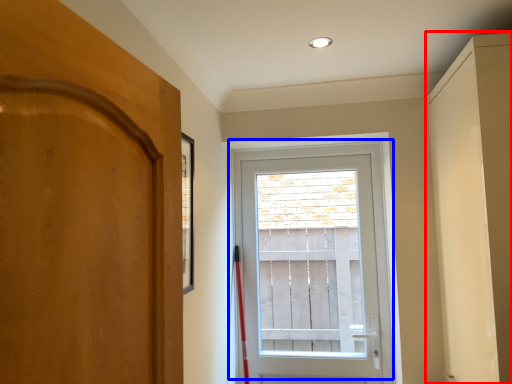
Question: Among these objects, which one is farthest to the camera, cabinetry (highlighted by a red box) or door (highlighted by a blue box)?

Choices:
 (A) cabinetry
 (B) door

Answer: (B)